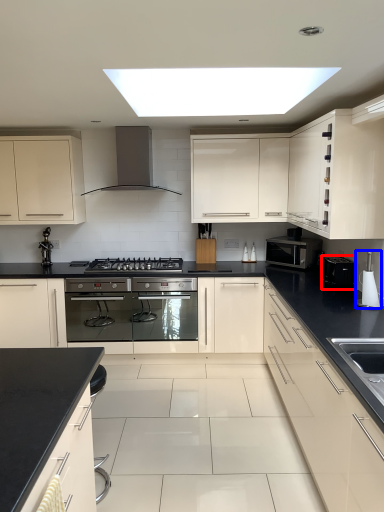
Question: Which object appears closest to the camera in this image, appliance (highlighted by a red box) or appliance (highlighted by a blue box)?

Choices:
 (A) appliance
 (B) appliance

Answer: (B)